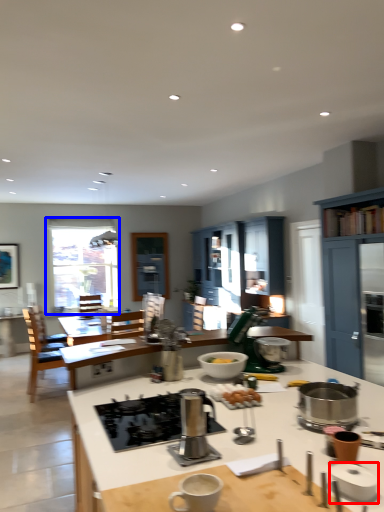
Question: Which of the following is the farthest to the observer, appliance (highlighted by a red box) or window (highlighted by a blue box)?

Choices:
 (A) appliance
 (B) window

Answer: (B)